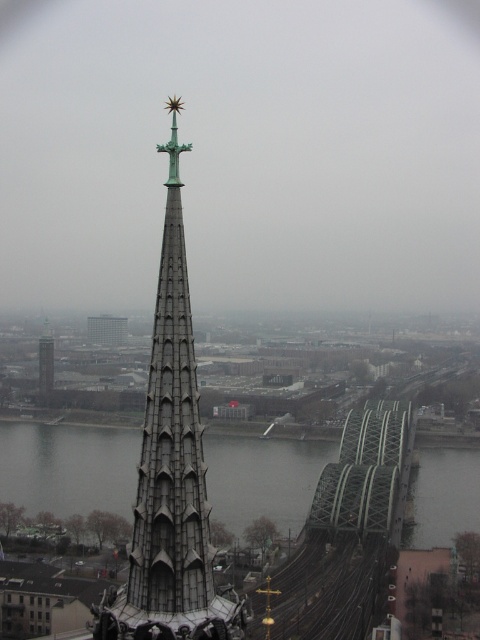
Is gray stone spire at center below gray metallic water at lower center?

No.

Is gray stone spire at center smaller than gray metallic water at lower center?

Yes, gray stone spire at center is smaller than gray metallic water at lower center.

Identify the location of gray stone spire at center. (170, 470).